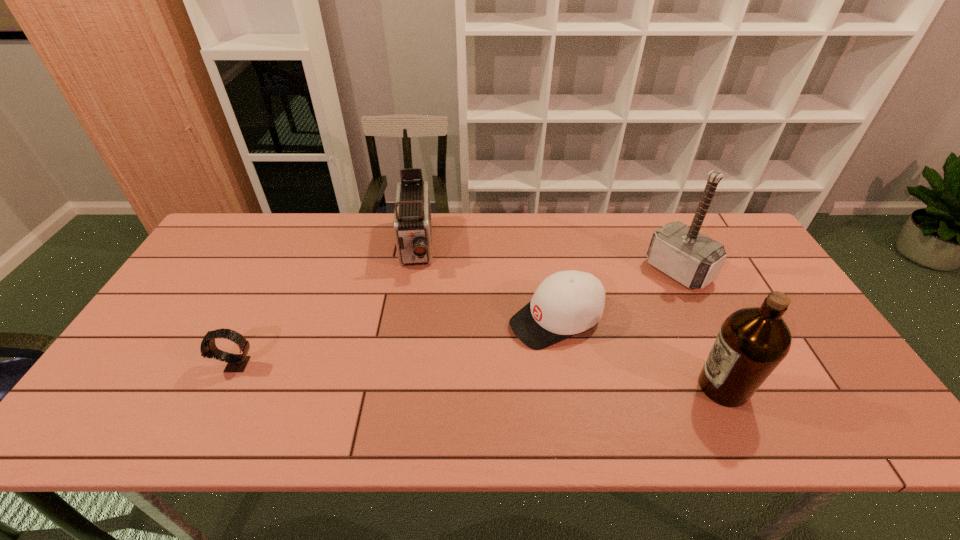
You are a GUI agent. You are given a task and a screenshot of the screen. Output one action in this format:
    pyautogui.click(x=<x>, y=<y>)
    Task: Click on the vacant area that lies between the third shortest object and the baseball cap
    The width and height of the screenshot is (960, 540).
    Given the screenshot: What is the action you would take?
    pyautogui.click(x=486, y=283)

The height and width of the screenshot is (540, 960). I want to click on free spot between the third object from right to left and the watch, so (x=396, y=342).

At what (x,y) coordinates should I click in order to perform the action: click on free space between the third object from right to left and the fourth object from right to left. Please return your answer as a coordinate pair (x, y). Looking at the image, I should click on (486, 283).

In order to click on free space between the hammer and the fourth object from right to left in this screenshot , I will do `click(547, 259)`.

This screenshot has height=540, width=960. Identify the location of empty location between the baseball cap and the third tallest object. (486, 283).

Where is `vacant region between the third tallest object and the hammer`? This screenshot has height=540, width=960. vacant region between the third tallest object and the hammer is located at coordinates (547, 259).

The width and height of the screenshot is (960, 540). In order to click on unoccupied position between the camcorder and the hammer in this screenshot , I will do `click(547, 259)`.

In order to click on blank region between the olive oil and the hammer in this screenshot , I will do `click(701, 329)`.

Select which object is the closest to the fourth object from right to left. Please provide its 2D coordinates. Your answer should be formatted as a tuple, i.e. [(x, y)], where the tuple contains the x and y coordinates of a point satisfying the conditions above.

[(566, 303)]

Locate which object is the fourth closest to the camcorder. Please provide its 2D coordinates. Your answer should be formatted as a tuple, i.e. [(x, y)], where the tuple contains the x and y coordinates of a point satisfying the conditions above.

[(753, 341)]